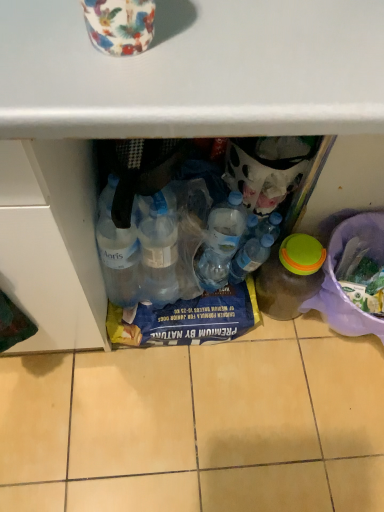
Question: Is transparent plastic bottle at center, the 1th bottle in the left-to-right sequence, taller or shorter than transparent plastic bottle at lower right, which is the first bottle in right-to-left order?

Choices:
 (A) tall
 (B) short

Answer: (B)

Question: Is transparent plastic bottle at center, positioned as the second bottle in right-to-left order, bigger or smaller than transparent plastic bottle at lower right, which is the first bottle in right-to-left order?

Choices:
 (A) big
 (B) small

Answer: (B)

Question: From a real-world perspective, is transparent plastic bottle at center, the 1th bottle in the left-to-right sequence, positioned above or below transparent plastic bottle at lower right, marked as the second bottle in a left-to-right arrangement?

Choices:
 (A) above
 (B) below

Answer: (A)

Question: Would you say transparent plastic bottle at lower right, which is the first bottle in right-to-left order, is to the left or to the right of transparent plastic bottle at center, the 1th bottle in the left-to-right sequence, in the picture?

Choices:
 (A) left
 (B) right

Answer: (B)

Question: From a real-world perspective, is transparent plastic bottle at lower right, which is the first bottle in right-to-left order, above or below transparent plastic bottle at center, the 1th bottle in the left-to-right sequence?

Choices:
 (A) above
 (B) below

Answer: (B)

Question: Choose the correct answer: Is transparent plastic bottle at lower right, marked as the second bottle in a left-to-right arrangement, inside transparent plastic bottle at center, positioned as the second bottle in right-to-left order, or outside it?

Choices:
 (A) outside
 (B) inside

Answer: (A)

Question: Looking at their shapes, would you say transparent plastic bottle at lower right, which is the first bottle in right-to-left order, is wider or thinner than transparent plastic bottle at center, the 1th bottle in the left-to-right sequence?

Choices:
 (A) wide
 (B) thin

Answer: (A)